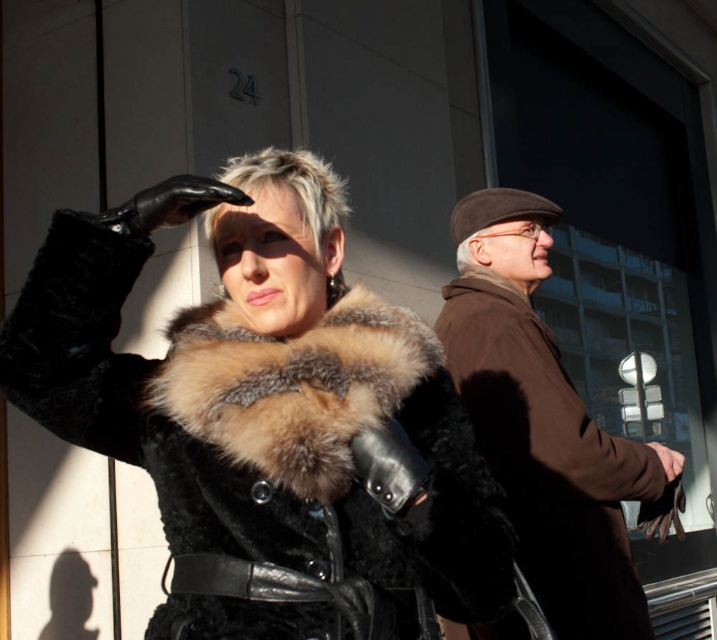
Looking at this image, how distant is brown woolen coat at right from brown fur coat at center?

A distance of 3.57 feet exists between brown woolen coat at right and brown fur coat at center.

Does brown woolen coat at right appear on the right side of brown fur coat at center?

Correct, you'll find brown woolen coat at right to the right of brown fur coat at center.

Measure the distance between point (526, 276) and camera.

Point (526, 276) is 3.26 meters from camera.

Where is `brown woolen coat at right`? This screenshot has width=717, height=640. brown woolen coat at right is located at coordinates (546, 426).

Can you confirm if fur coat at center is positioned to the right of brown woolen coat at right?

In fact, fur coat at center is to the left of brown woolen coat at right.

Can you confirm if fur coat at center is shorter than brown woolen coat at right?

Yes.

What do you see at coordinates (261, 388) in the screenshot?
I see `fur coat at center` at bounding box center [261, 388].

I want to click on fur coat at center, so click(261, 388).

Based on the photo, does fur coat at center have a lesser height compared to brown fur coat at center?

In fact, fur coat at center may be taller than brown fur coat at center.

Between fur coat at center and brown fur coat at center, which one is positioned lower?

fur coat at center is lower down.

Which is behind, point (199, 540) or point (310, 436)?

The point (199, 540) is more distant.

The width and height of the screenshot is (717, 640). I want to click on fur coat at center, so click(261, 388).